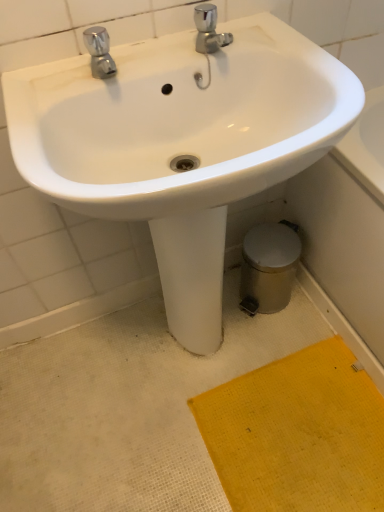
Where is `vacant space to the left of polished chrome faucet at upper left`? The width and height of the screenshot is (384, 512). vacant space to the left of polished chrome faucet at upper left is located at coordinates (44, 86).